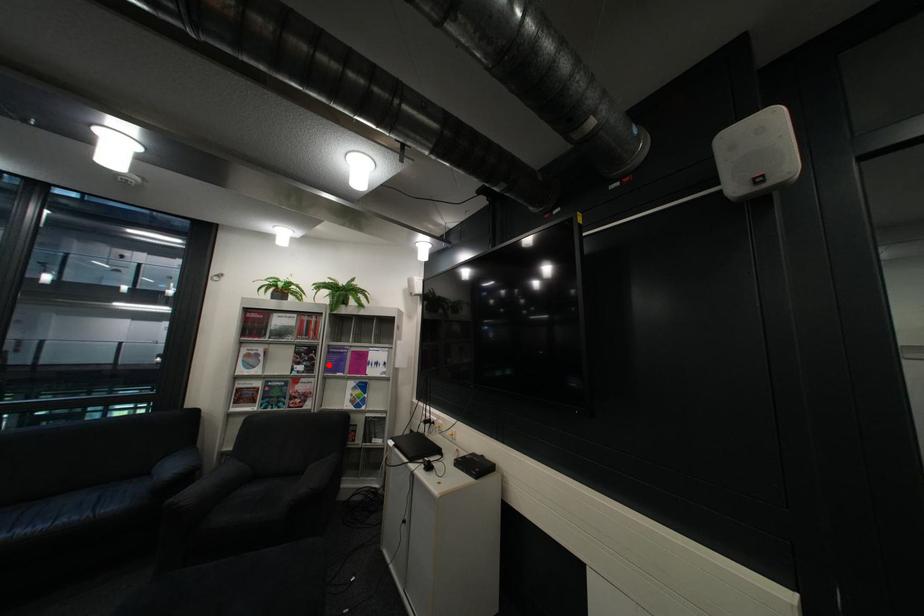
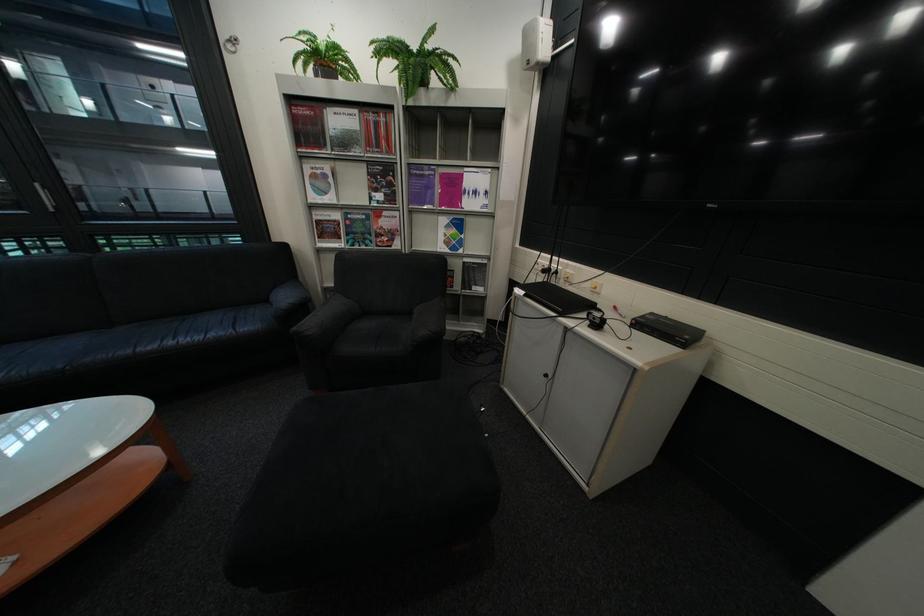
Question: I am providing you with two images of the same scene from different viewpoints. Given a red point in image1, look at the same physical point in image2. Is it:

Choices:
 (A) Closer to the viewpoint
 (B) Farther from the viewpoint

Answer: (A)